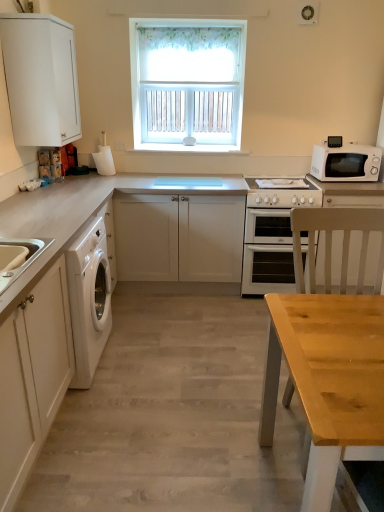
Locate an element on the screen. white matte washing machine at left is located at coordinates (89, 298).

Locate an element on the screen. Image resolution: width=384 pixels, height=512 pixels. white wooden window at upper center is located at coordinates (187, 83).

Where is `white ceramic sink at lower left`? The height and width of the screenshot is (512, 384). white ceramic sink at lower left is located at coordinates (25, 259).

Image resolution: width=384 pixels, height=512 pixels. Find the location of `white glossy oven at center`. white glossy oven at center is located at coordinates (272, 237).

Locate an element on the screen. white matte washing machine at left is located at coordinates (89, 298).

Which object is positioned more to the right, white matte cabinet at center, which appears as the 3th cabinetry when viewed from the front, or white matte microwave at right?

white matte microwave at right.

Is white matte microwave at right at the back of white matte cabinet at center, placed as the 2th cabinetry when sorted from top to bottom?

No.

From a real-world perspective, which cabinetry is the 1st one underneath the white matte microwave at right? Please provide its 2D coordinates.

[(178, 237)]

From the picture: Can you see white matte cabinet at center, which ranks as the second cabinetry in bottom-to-top order, touching white matte microwave at right?

white matte cabinet at center, which ranks as the second cabinetry in bottom-to-top order, is not next to white matte microwave at right, and they're not touching.

Can you confirm if white matte cabinet at upper left, which is the 2th cabinetry in back-to-front order, is shorter than white wooden window at upper center?

Yes.

From the picture: From the image's perspective, is white matte cabinet at upper left, the first cabinetry positioned from the top, below white wooden window at upper center?

Correct, white matte cabinet at upper left, the first cabinetry positioned from the top, appears lower than white wooden window at upper center in the image.

Is there a large distance between white matte cabinet at upper left, the 3th cabinetry in the bottom-to-top sequence, and white wooden window at upper center?

Indeed, white matte cabinet at upper left, the 3th cabinetry in the bottom-to-top sequence, is not near white wooden window at upper center.

From a real-world perspective, between white matte cabinet at upper left, the first cabinetry positioned from the top, and white wooden window at upper center, who is vertically lower?

white wooden window at upper center.

From the image's perspective, between white glossy gas stove at center and wooden table at center, which one is located above?

white glossy gas stove at center, from the image's perspective.

Is the surface of white glossy gas stove at center in direct contact with wooden table at center?

They are not placed beside each other.

Based on the photo, is white glossy gas stove at center thinner than wooden table at center?

Yes.

From a real-world perspective, is white glossy gas stove at center located higher than wooden table at center?

Correct, in the physical world, white glossy gas stove at center is higher than wooden table at center.

Which is in front, wooden table at center or white matte cabinet at left, the 1th cabinetry viewed from the front?

white matte cabinet at left, the 1th cabinetry viewed from the front.

From a real-world perspective, is wooden table at center physically located above or below white matte cabinet at left, the 1th cabinetry in the bottom-to-top sequence?

wooden table at center is below white matte cabinet at left, the 1th cabinetry in the bottom-to-top sequence.

Locate an element on the screen. This screenshot has width=384, height=512. countertop behind the white matte cabinet at left, the 3th cabinetry when ordered from back to front is located at coordinates (50, 310).

Are white glossy oven at center and white matte washing machine at left located far from each other?

Yes, white glossy oven at center and white matte washing machine at left are quite far apart.

Which of these two, white glossy oven at center or white matte washing machine at left, is wider?

With larger width is white glossy oven at center.

Is point (284, 232) positioned before point (89, 298)?

No, it is behind (89, 298).

From a real-world perspective, is white glossy oven at center located beneath white matte washing machine at left?

Yes, from a real-world perspective, white glossy oven at center is under white matte washing machine at left.

Can you confirm if white ceramic sink at lower left is smaller than white matte cabinet at center, which appears as the 3th cabinetry when viewed from the front?

Correct, white ceramic sink at lower left occupies less space than white matte cabinet at center, which appears as the 3th cabinetry when viewed from the front.

Choose the correct answer: Is white ceramic sink at lower left inside white matte cabinet at center, which ranks as the second cabinetry in bottom-to-top order, or outside it?

white ceramic sink at lower left cannot be found inside white matte cabinet at center, which ranks as the second cabinetry in bottom-to-top order.

Does point (3, 244) lie in front of point (176, 247)?

Yes, it is in front of point (176, 247).

Considering the sizes of white ceramic sink at lower left and white matte cabinet at center, placed as the 2th cabinetry when sorted from top to bottom, in the image, is white ceramic sink at lower left wider or thinner than white matte cabinet at center, placed as the 2th cabinetry when sorted from top to bottom,?

Clearly, white ceramic sink at lower left has less width compared to white matte cabinet at center, placed as the 2th cabinetry when sorted from top to bottom.

Consider the image. From a real-world perspective, between light wood chair at right and white matte washing machine at left, who is vertically lower?

In real-world perspective, white matte washing machine at left is lower.

Is point (348, 212) farther from camera compared to point (85, 351)?

That is False.

From the image's perspective, would you say light wood chair at right is positioned over white matte washing machine at left?

Actually, light wood chair at right appears below white matte washing machine at left in the image.

Based on the photo, is light wood chair at right spatially inside white matte washing machine at left, or outside of it?

light wood chair at right exists outside the volume of white matte washing machine at left.

Where is `kitchen appliance behind the white matte cabinet at center, which is the 1th cabinetry in back-to-front order`? The width and height of the screenshot is (384, 512). kitchen appliance behind the white matte cabinet at center, which is the 1th cabinetry in back-to-front order is located at coordinates (346, 163).

You are a GUI agent. You are given a task and a screenshot of the screen. Output one action in this format:
    pyautogui.click(x=<x>, y=<y>)
    Task: Click on the cabinetry that appears above the white wooden window at upper center (from a real-world perspective)
    The width and height of the screenshot is (384, 512).
    Given the screenshot: What is the action you would take?
    pyautogui.click(x=40, y=79)

Based on their spatial positions, is white matte microwave at right or white matte cabinet at left, which is the third cabinetry in top-to-bottom order, closer to white wooden window at upper center?

The object closer to white wooden window at upper center is white matte microwave at right.

Looking at the image, which one is located further to light wood chair at right, white ceramic sink at lower left or white matte cabinet at left, the 1th cabinetry viewed from the front?

white ceramic sink at lower left is positioned further to the anchor light wood chair at right.

From the image, which object appears to be farther from white matte cabinet at center, placed as the 2th cabinetry when sorted from top to bottom, white matte cabinet at upper left, which is the 2th cabinetry in back-to-front order, or white ceramic sink at lower left?

Among the two, white ceramic sink at lower left is located further to white matte cabinet at center, placed as the 2th cabinetry when sorted from top to bottom.

From the picture: When comparing their distances from white glossy oven at center, does white wooden window at upper center or white glossy gas stove at center seem further?

Among the two, white wooden window at upper center is located further to white glossy oven at center.

Considering their positions, is white glossy gas stove at center positioned further to light wood chair at right than white matte microwave at right?

Among the two, white matte microwave at right is located further to light wood chair at right.

Which object lies further to the anchor point white glossy gas stove at center, white matte washing machine at left or light wood chair at right?

white matte washing machine at left is further to white glossy gas stove at center.

Considering their positions, is white matte washing machine at left positioned closer to white matte cabinet at upper left, the 3th cabinetry in the bottom-to-top sequence, than white matte cabinet at center, which is the 1th cabinetry in back-to-front order?

white matte cabinet at center, which is the 1th cabinetry in back-to-front order, lies closer to white matte cabinet at upper left, the 3th cabinetry in the bottom-to-top sequence, than the other object.

Consider the image. Estimate the real-world distances between objects in this image. Which object is closer to white glossy oven at center, white matte cabinet at upper left, the 3th cabinetry in the bottom-to-top sequence, or light wood chair at right?

light wood chair at right lies closer to white glossy oven at center than the other object.

Where is `countertop located between white matte cabinet at left, the 3th cabinetry when ordered from back to front, and white matte cabinet at center, placed as the 2th cabinetry when sorted from top to bottom, in the depth direction`? This screenshot has width=384, height=512. countertop located between white matte cabinet at left, the 3th cabinetry when ordered from back to front, and white matte cabinet at center, placed as the 2th cabinetry when sorted from top to bottom, in the depth direction is located at coordinates (50, 310).

Find the location of `washing machine between white matte cabinet at left, which is the third cabinetry in top-to-bottom order, and white matte cabinet at center, placed as the 2th cabinetry when sorted from top to bottom, along the z-axis`. washing machine between white matte cabinet at left, which is the third cabinetry in top-to-bottom order, and white matte cabinet at center, placed as the 2th cabinetry when sorted from top to bottom, along the z-axis is located at coordinates (89, 298).

Find the location of a particular element. The height and width of the screenshot is (512, 384). oven between white matte cabinet at left, which is the third cabinetry in top-to-bottom order, and white wooden window at upper center, along the z-axis is located at coordinates (272, 237).

Where is `washing machine between white matte cabinet at left, the 1th cabinetry viewed from the front, and wooden table at center, in the horizontal direction`? The image size is (384, 512). washing machine between white matte cabinet at left, the 1th cabinetry viewed from the front, and wooden table at center, in the horizontal direction is located at coordinates (89, 298).